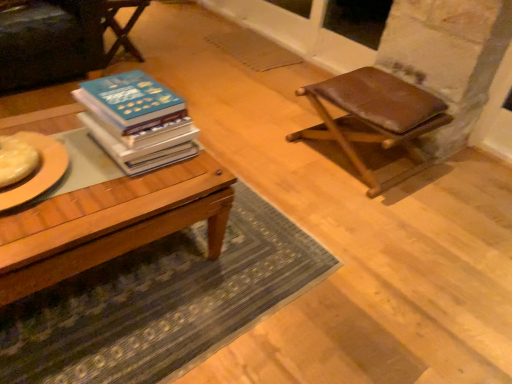
Find the location of a particular element. The width and height of the screenshot is (512, 384). vacant area on the back side of green textured rug at lower center is located at coordinates (252, 135).